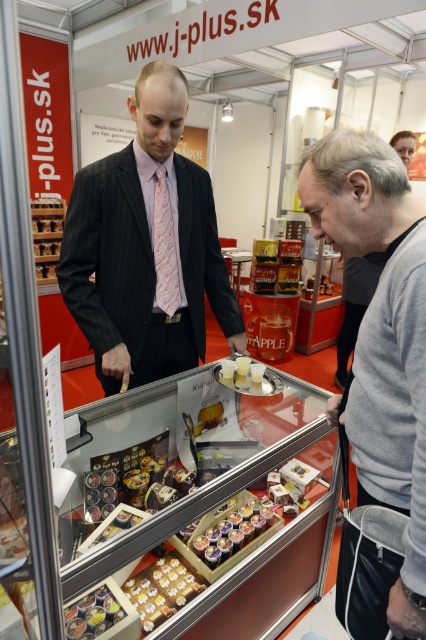
Does dark pinstripe suit at center appear under shiny chocolate bar at center?

No, dark pinstripe suit at center is not below shiny chocolate bar at center.

What do you see at coordinates (146, 248) in the screenshot? I see `dark pinstripe suit at center` at bounding box center [146, 248].

Identify the location of dark pinstripe suit at center. (146, 248).

Measure the distance between dark pinstripe suit at center and camera.

dark pinstripe suit at center is 4.52 feet away from camera.

Who is shorter, dark pinstripe suit at center or shiny metallic canisters at center?

Standing shorter between the two is shiny metallic canisters at center.

Is point (135, 221) closer to viewer compared to point (221, 545)?

No, it is behind (221, 545).

The width and height of the screenshot is (426, 640). I want to click on dark pinstripe suit at center, so click(x=146, y=248).

Who is more distant from viewer, (198, 266) or (405, 160)?

The point (405, 160) is more distant.

Who is more forward, (173, 164) or (409, 150)?

Positioned in front is point (173, 164).

Find the location of `dark pinstripe suit at center`. dark pinstripe suit at center is located at coordinates (146, 248).